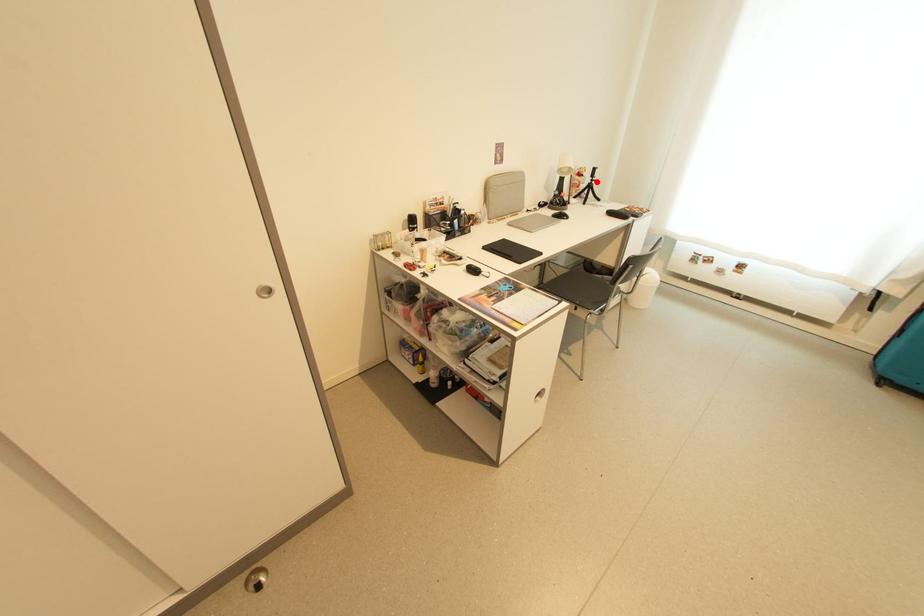
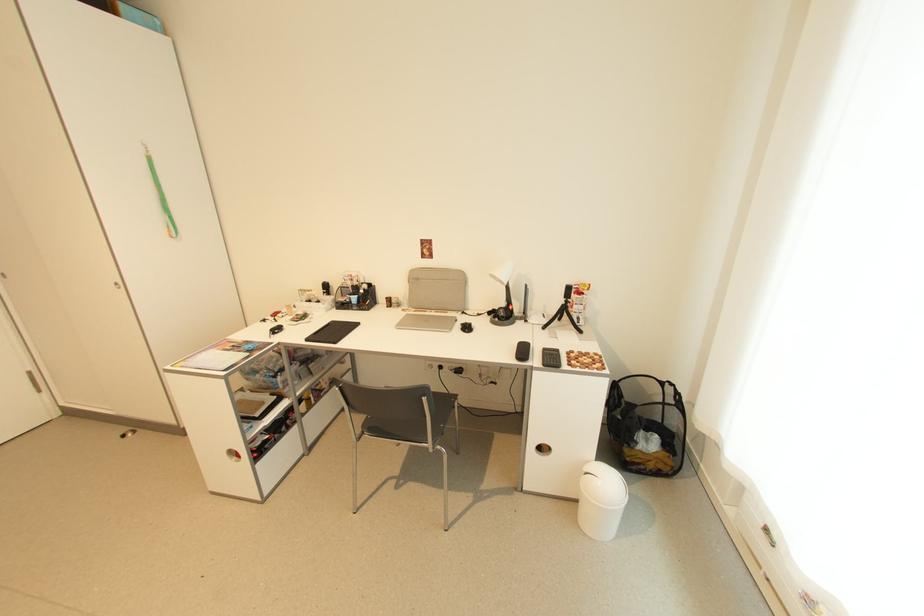
Locate, in the second image, the point that corresponds to the highlighted location in the first image.

(572, 302)